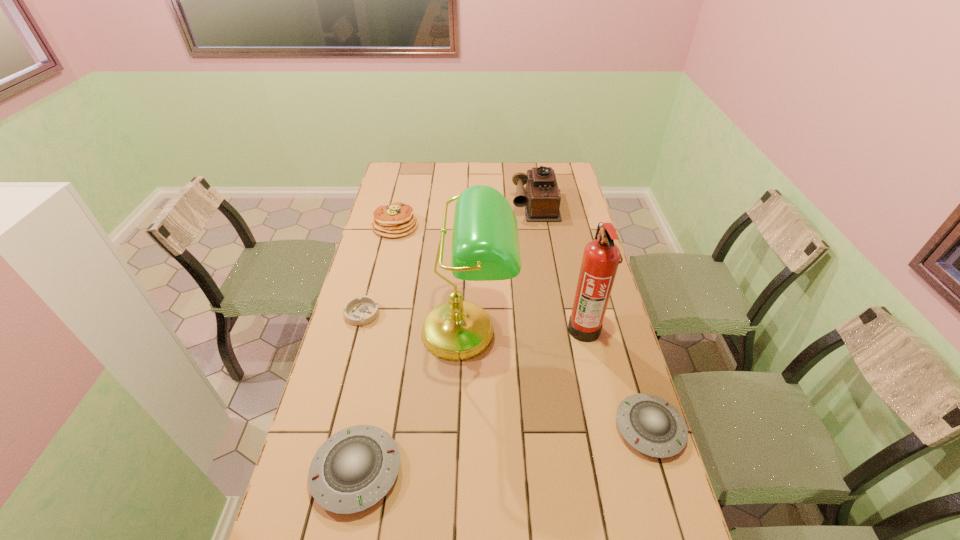
Please point a location where one more saucer can be added evenly. Please provide its 2D coordinates. Your answer should be formatted as a tuple, i.e. [(x, y)], where the tuple contains the x and y coordinates of a point satisfying the conditions above.

[(509, 449)]